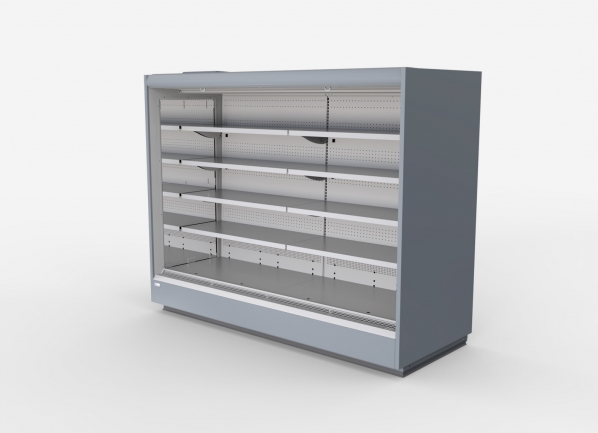
You are a GUI agent. You are given a task and a screenshot of the screen. Output one action in this format:
    pyautogui.click(x=<x>, y=<y>)
    Task: Click on the bottom of cabinet
    The width and height of the screenshot is (598, 433).
    Given the screenshot: What is the action you would take?
    pyautogui.click(x=297, y=345)